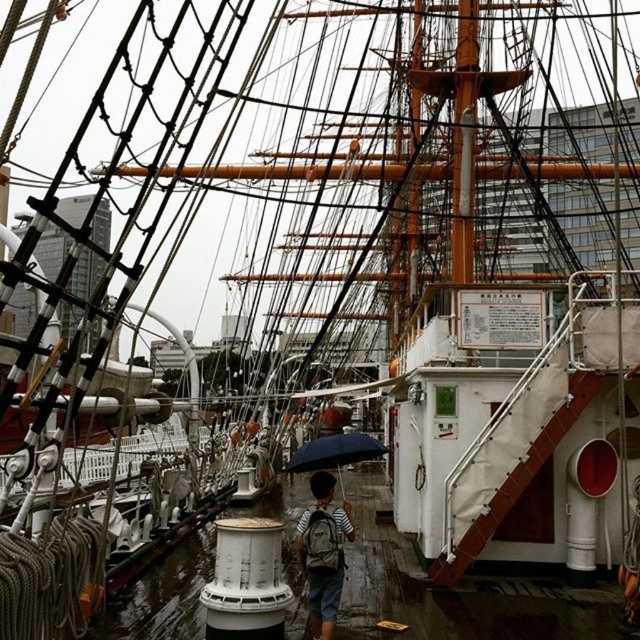
You are a photographer standing on the deck of the historic ship. You notice a striped fabric backpack at center and a dark blue matte umbrella at center. Which object is positioned higher relative to the other?

The striped fabric backpack at center is above the dark blue matte umbrella at center.

You are standing on the deck of the historic sailing ship and want to move from one point to another. Which of the two points, point (330, 515) or point (294, 452), is closer to you?

Point (330, 515) is closer to the viewer than point (294, 452).